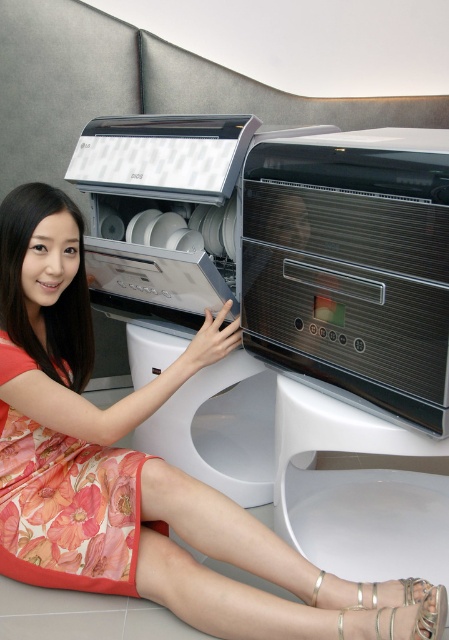
You are a delivery person who needs to move a large package through the kitchen. The package is 1.2 meters wide. You see the white glossy dishwasher at center and the floral silk dress at lower left. Can the package fit between them?

The white glossy dishwasher at center is larger than the floral silk dress at lower left. However, the exact distance between them isn not specified. Without knowing the space between the two objects, it is impossible to determine if the package will fit.

You are standing in front of the LG appliances and notice two points marked on the floor. The first point is at coordinate point(x=196, y=337) and the second is at point(x=57, y=483). Which point is closer to you?

Point(x=196, y=337) is closer to you because it is further to the viewer than point(x=57, y=483).